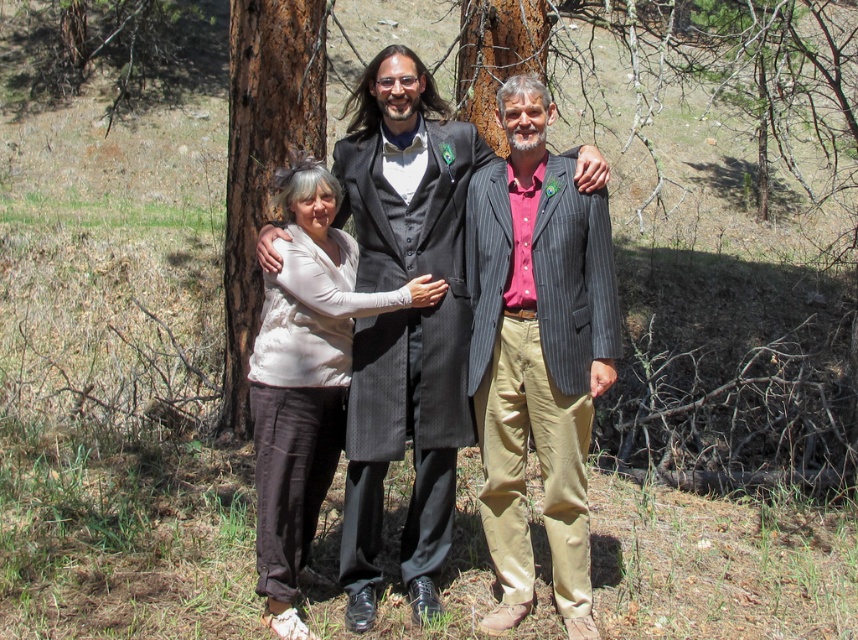
In the scene shown: Who is higher up, matte black suit at center or brown rough bark tree at left?

brown rough bark tree at left

Does matte black suit at center have a smaller size compared to brown rough bark tree at left?

Correct, matte black suit at center occupies less space than brown rough bark tree at left.

The height and width of the screenshot is (640, 858). I want to click on matte black suit at center, so click(x=405, y=323).

Is matte beige blouse at center to the right of brown rough bark tree at left from the viewer's perspective?

Correct, you'll find matte beige blouse at center to the right of brown rough bark tree at left.

Measure the distance between matte beige blouse at center and brown rough bark tree at left.

A distance of 3.02 meters exists between matte beige blouse at center and brown rough bark tree at left.

The image size is (858, 640). Describe the element at coordinates (305, 376) in the screenshot. I see `matte beige blouse at center` at that location.

Identify the location of matte beige blouse at center. (305, 376).

Who is higher up, striped wool blazer at center or brown rough bark tree at left?

Positioned higher is brown rough bark tree at left.

Is point (565, 376) closer to camera compared to point (236, 301)?

That is True.

This screenshot has height=640, width=858. In order to click on striped wool blazer at center in this screenshot , I will do `click(536, 353)`.